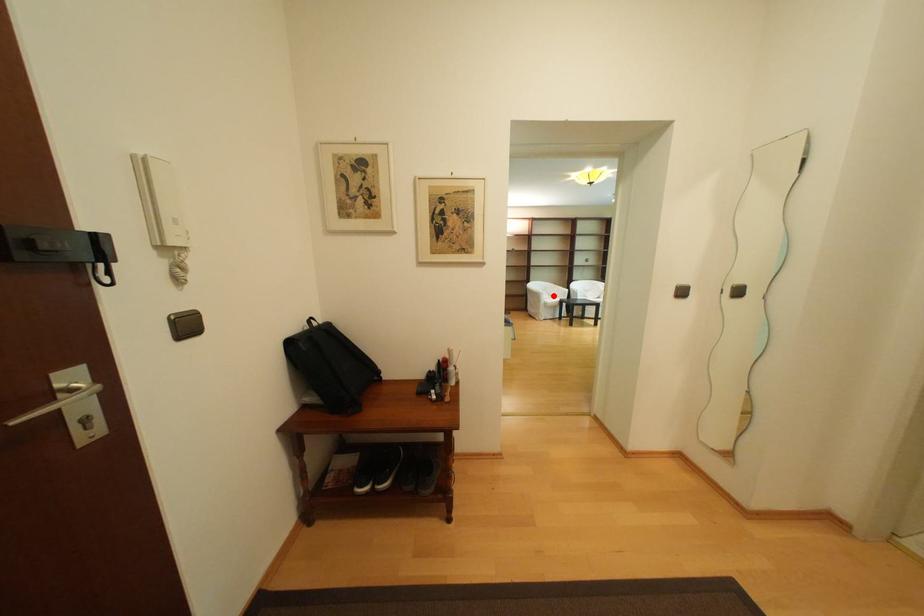
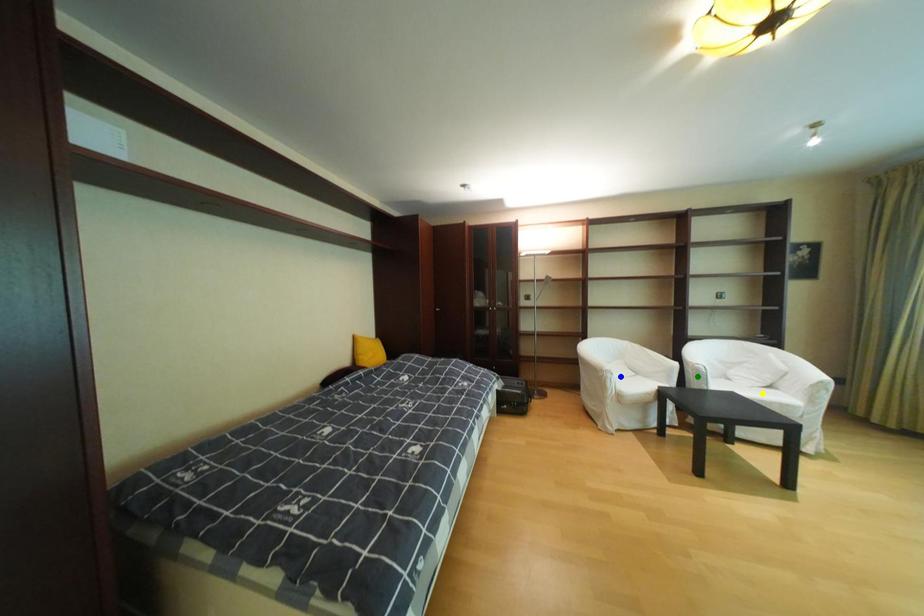
Question: I am providing you with two images of the same scene from different viewpoints. A red point is marked on the first image. You are given multiple points on the second image. Which point in image 2 is actually the same real-world point as the red point in image 1?

Choices:
 (A) green point
 (B) yellow point
 (C) blue point

Answer: (C)